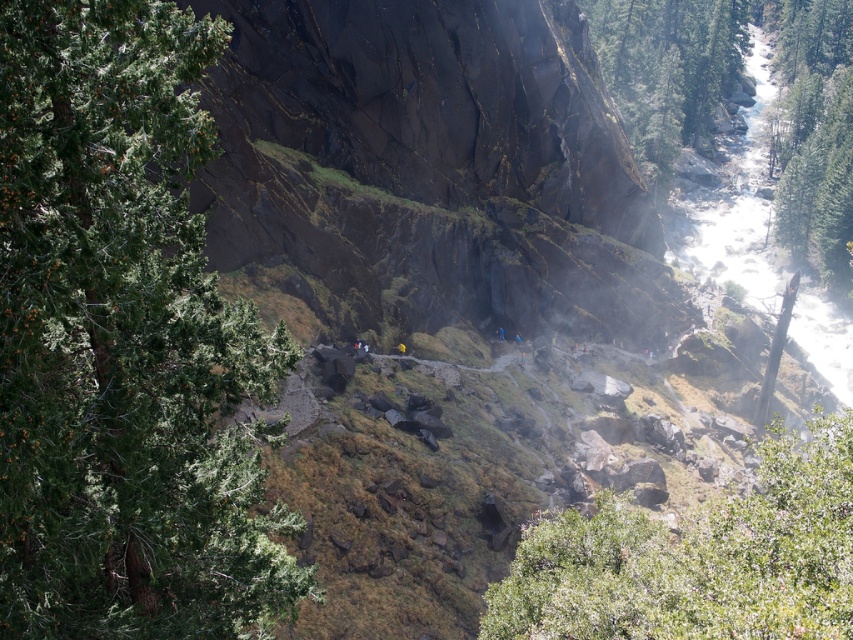
You are a hiker standing at the base of the steep, dark rock face on the left side of the frame. You see the green leafy tree at left and the green textured tree at upper center. Which tree is closer to your current position?

The green leafy tree at left is closer to your current position because it is located below the green textured tree at upper center, indicating it is positioned lower in the landscape and thus nearer to the base of the rock face where you are standing.

You are a hiker planning to take a photo of both the green leafy tree at left and the green textured tree at right. Which tree should you stand closer to in order to capture both in the same frame?

You should stand closer to the green leafy tree at left because it is smaller in size compared to the green textured tree at right, allowing both trees to fit within the camera frame more easily.

You are a hiker trying to navigate through the mountain path. You see a green leafy tree at left and a green textured tree at upper center. Which tree has a smaller width?

The green leafy tree at left is thinner than the green textured tree at upper center, so the green leafy tree at left has a smaller width.